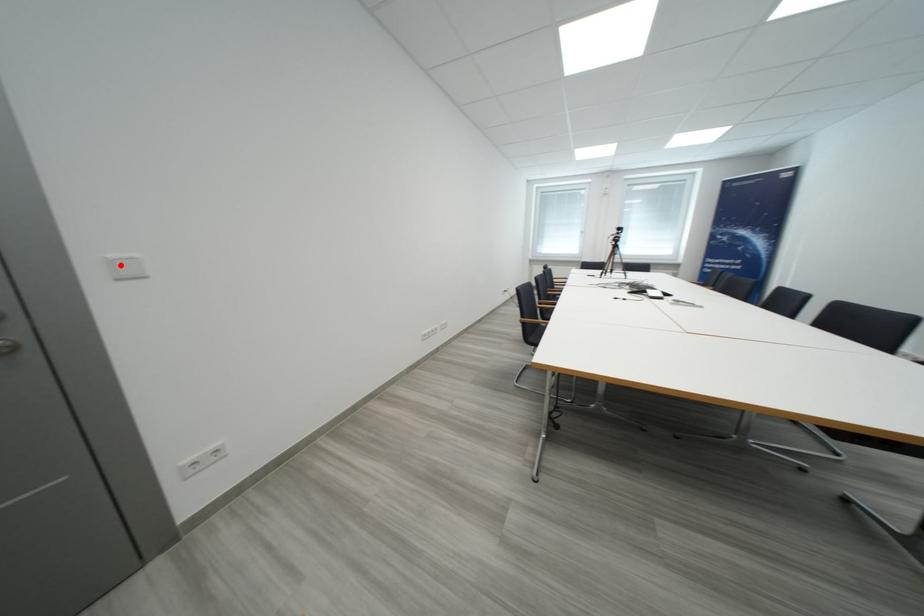
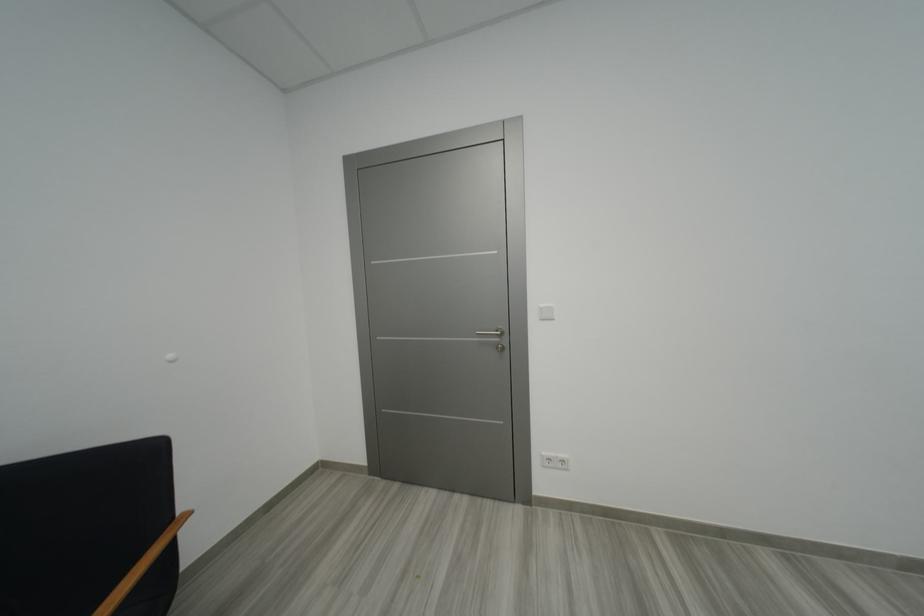
The point at the highlighted location is marked in the first image. Where is the corresponding point in the second image?

(548, 312)